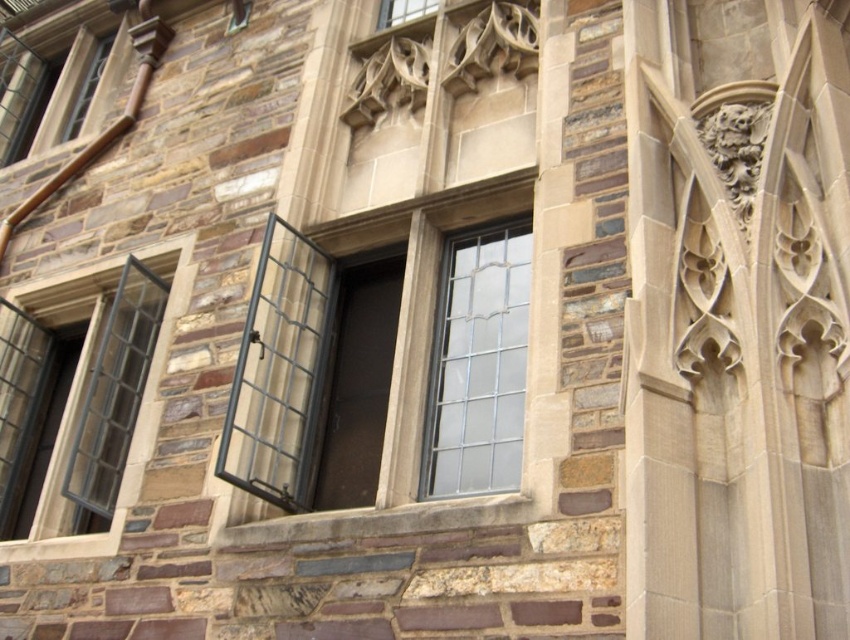
Question: Which of these objects is positioned closest to the clear glass window at upper center?

Choices:
 (A) matte black window at lower left
 (B) clear glass window at upper left
 (C) clear glass window at center

Answer: (C)

Question: Which of the following is the closest to the observer?

Choices:
 (A) (37, 532)
 (B) (408, 16)
 (C) (523, 241)

Answer: (C)

Question: Is matte black window at lower left to the left of clear glass window at upper center from the viewer's perspective?

Choices:
 (A) no
 (B) yes

Answer: (B)

Question: Does clear glass window at upper left have a smaller size compared to clear glass window at upper center?

Choices:
 (A) yes
 (B) no

Answer: (B)

Question: In this image, where is matte black window at lower left located relative to clear glass window at upper left?

Choices:
 (A) left
 (B) right

Answer: (B)

Question: Which point is closer to the camera taking this photo?

Choices:
 (A) (82, 100)
 (B) (488, 470)
 (C) (425, 8)
 (D) (72, 300)

Answer: (B)